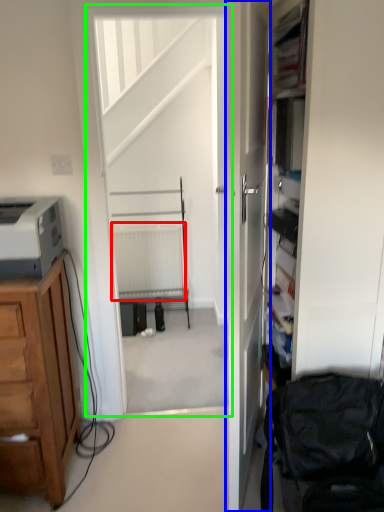
Question: Considering the real-world distances, which object is farthest from radiator (highlighted by a red box)? door (highlighted by a blue box) or screen door (highlighted by a green box)?

Choices:
 (A) door
 (B) screen door

Answer: (A)